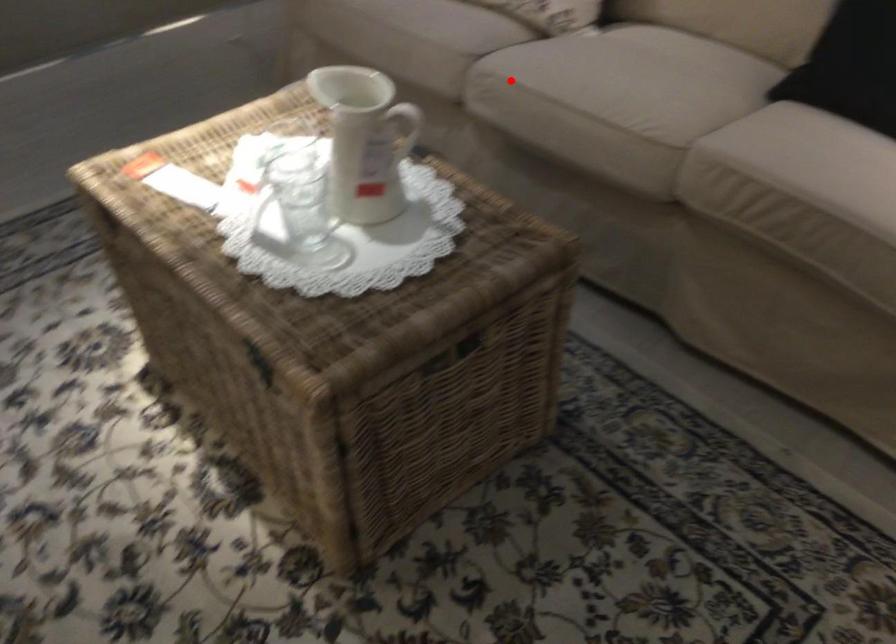
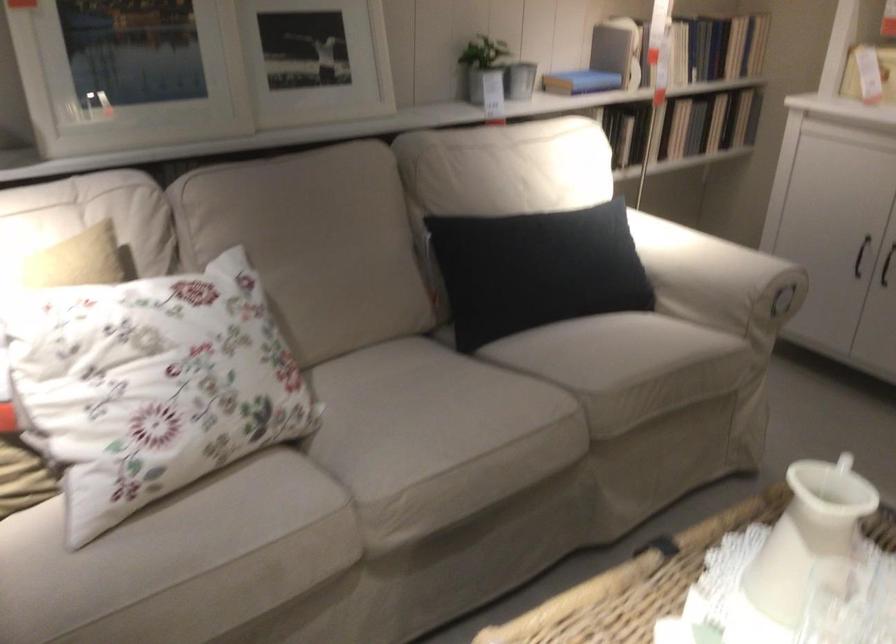
In the second image, find the point that corresponds to the highlighted location in the first image.

(398, 494)